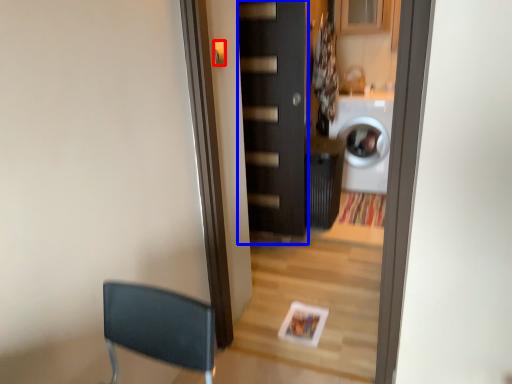
Question: Which point is further to the camera, door handle (highlighted by a red box) or door (highlighted by a blue box)?

Choices:
 (A) door handle
 (B) door

Answer: (B)